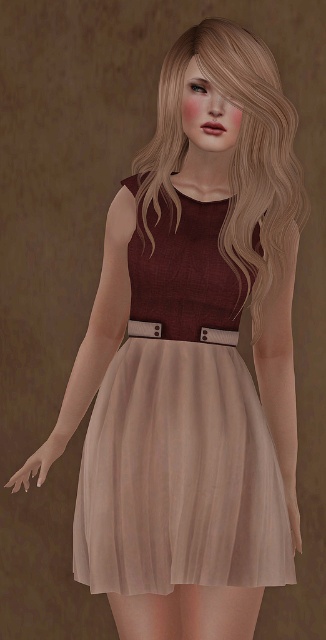
From the picture: Which is below, blondehair at center or metallic silver belt at center?

metallic silver belt at center is lower down.

Who is more distant from viewer, (264, 138) or (218, 333)?

The point (218, 333) is behind.

Where is `blondehair at center`? blondehair at center is located at coordinates (235, 148).